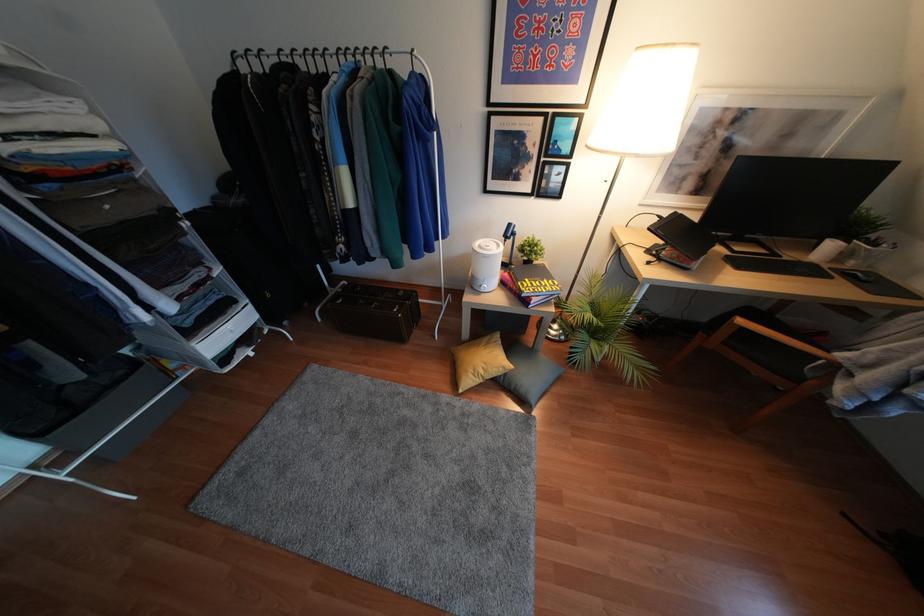
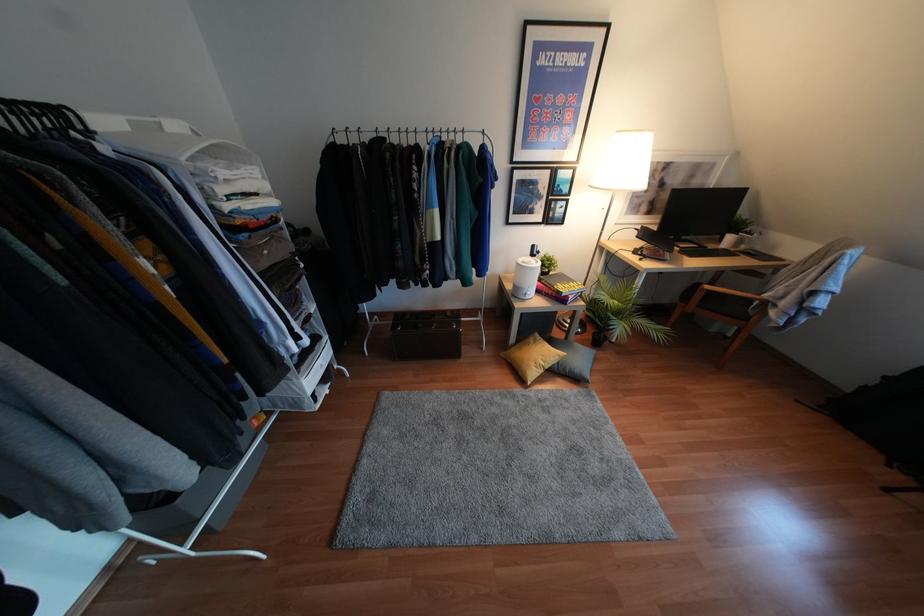
Question: I am providing you with two images of the same scene from different viewpoints. After the viewpoint changes to image2, which objects are now occluded?

Choices:
 (A) stacked books
 (B) grey cushion
 (C) wooden chair armrest
 (D) none of these

Answer: (D)